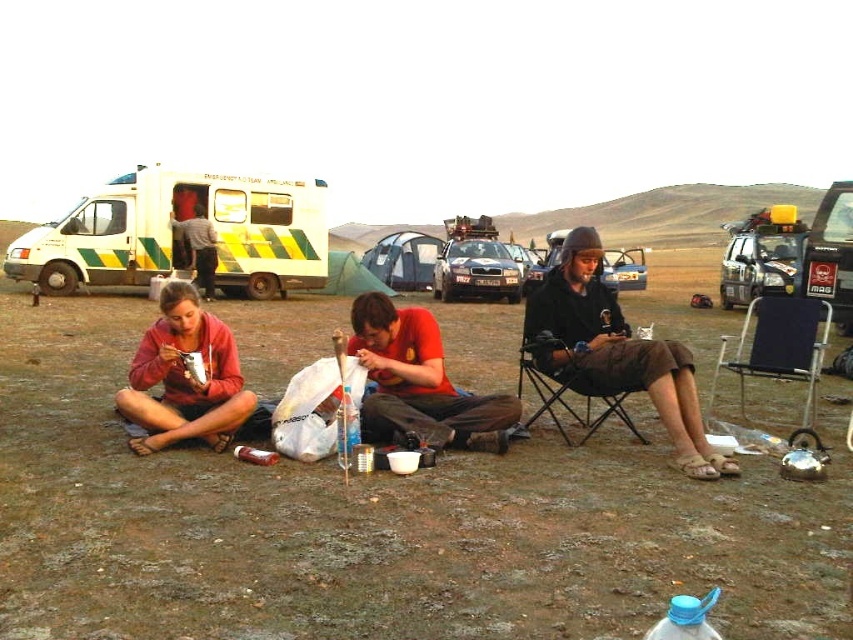
Does dark brown fabric jacket at center come behind red cotton shirt at center?

No, it is in front of red cotton shirt at center.

Locate an element on the screen. The height and width of the screenshot is (640, 853). dark brown fabric jacket at center is located at coordinates (614, 353).

Is point (607, 300) positioned in front of point (376, 368)?

No.

This screenshot has width=853, height=640. I want to click on dark brown fabric jacket at center, so click(x=614, y=353).

Can you confirm if dark brown fabric jacket at center is shorter than matte red hoodie at lower left?

No, dark brown fabric jacket at center is not shorter than matte red hoodie at lower left.

This screenshot has width=853, height=640. Describe the element at coordinates (614, 353) in the screenshot. I see `dark brown fabric jacket at center` at that location.

You are a GUI agent. You are given a task and a screenshot of the screen. Output one action in this format:
    pyautogui.click(x=<x>, y=<y>)
    Task: Click on the dark brown fabric jacket at center
    This screenshot has width=853, height=640.
    Given the screenshot: What is the action you would take?
    pyautogui.click(x=614, y=353)

Which is below, black fabric folding chair at center or black fabric chair at center?

black fabric chair at center is lower down.

Does black fabric folding chair at center appear on the right side of black fabric chair at center?

Correct, you'll find black fabric folding chair at center to the right of black fabric chair at center.

This screenshot has height=640, width=853. What are the coordinates of `black fabric folding chair at center` in the screenshot? It's located at (776, 348).